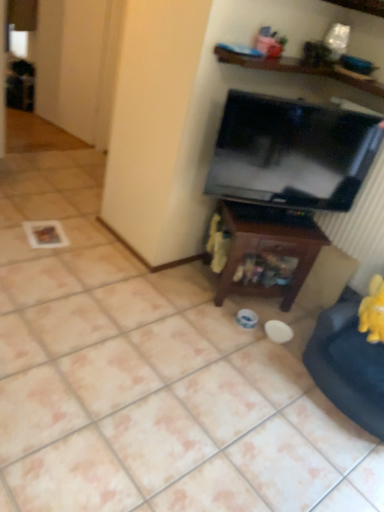
Identify the location of free point in front of brown wood table at center. (227, 338).